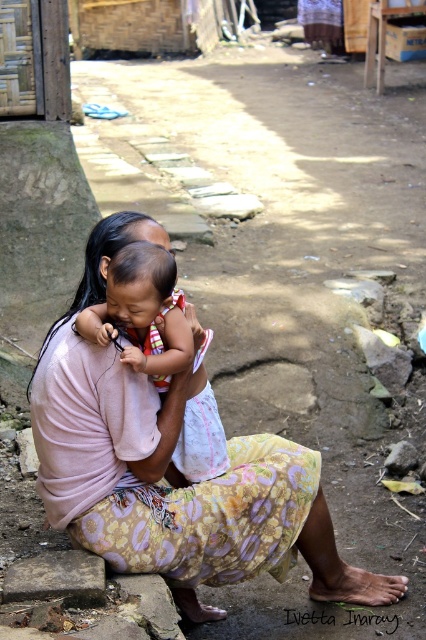
Can you confirm if patterned fabric baby at center is wider than soft pink fabric baby at center?

Yes.

This screenshot has height=640, width=426. I want to click on patterned fabric baby at center, so click(x=166, y=468).